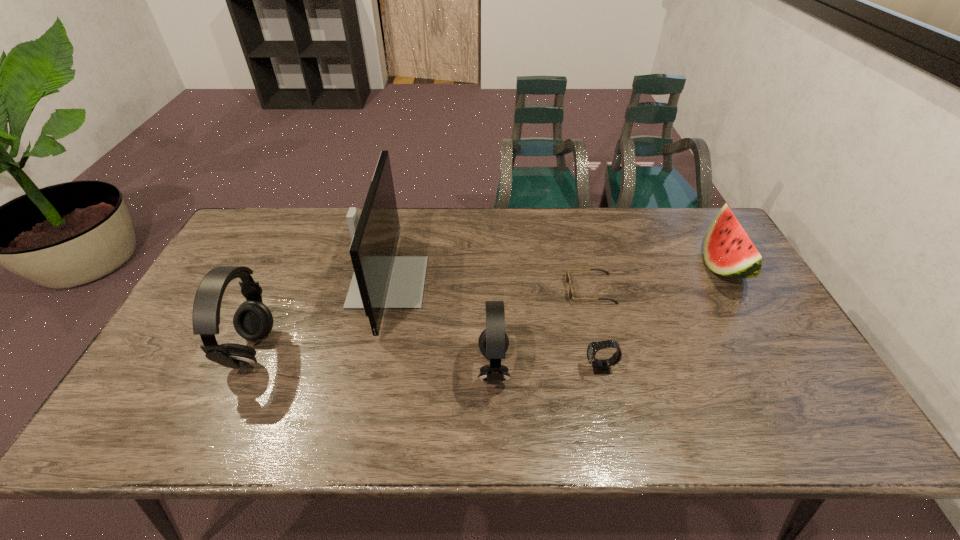
Please point a free position for a earphone on the right. Please provide its 2D coordinates. Your answer should be formatted as a tuple, i.e. [(x, y)], where the tuple contains the x and y coordinates of a point satisfying the conditions above.

[(753, 388)]